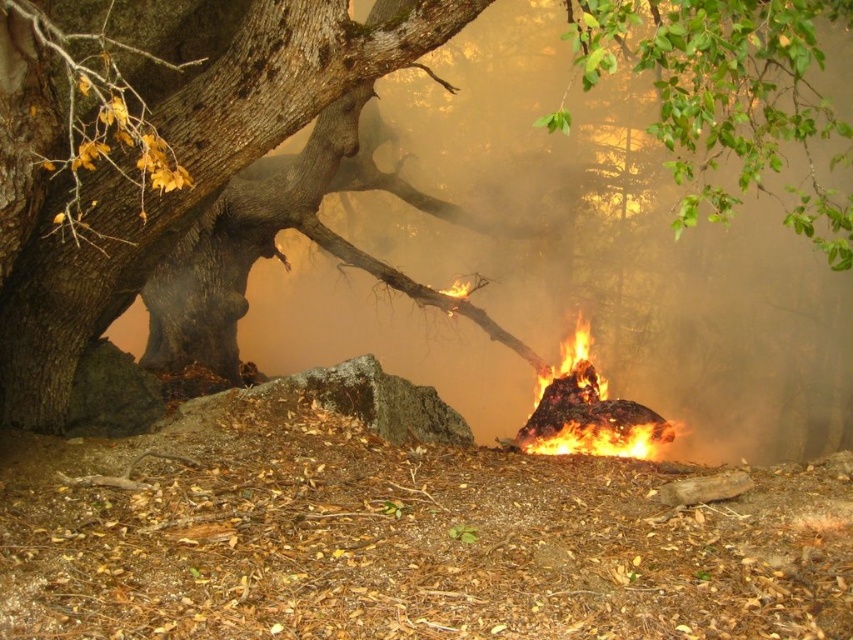
Can you confirm if rough bark tree at center is bigger than flaming debris at center?

Indeed, rough bark tree at center has a larger size compared to flaming debris at center.

Which of these two, rough bark tree at center or flaming debris at center, stands taller?

With more height is rough bark tree at center.

Find the location of a particular element. The height and width of the screenshot is (640, 853). rough bark tree at center is located at coordinates (175, 163).

The image size is (853, 640). Identify the location of rough bark tree at center. (175, 163).